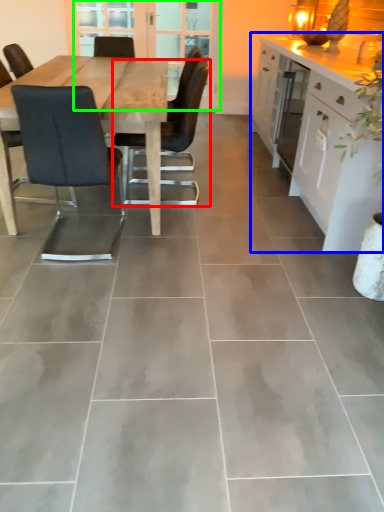
Question: Which is farther away from chair (highlighted by a red box)? cabinetry (highlighted by a blue box) or screen door (highlighted by a green box)?

Choices:
 (A) cabinetry
 (B) screen door

Answer: (B)